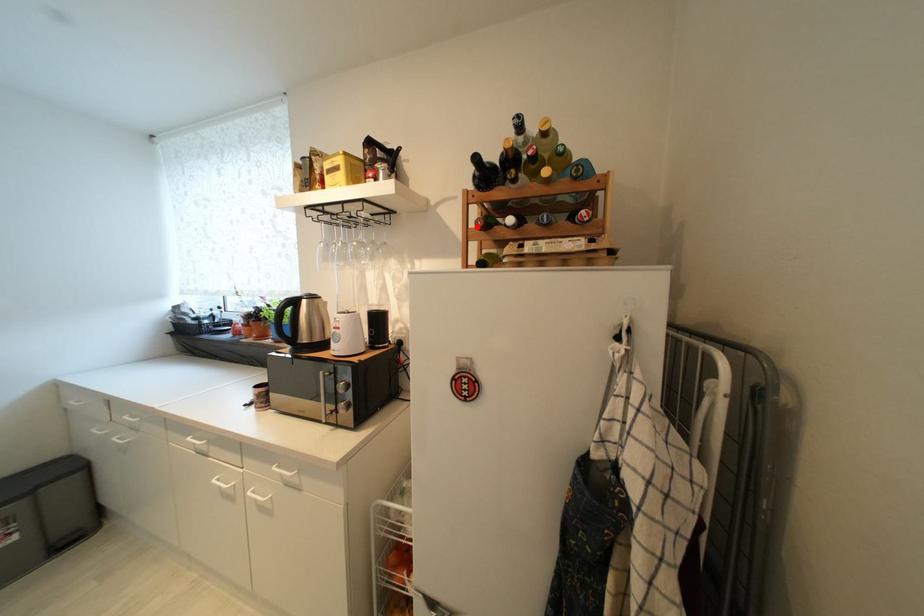
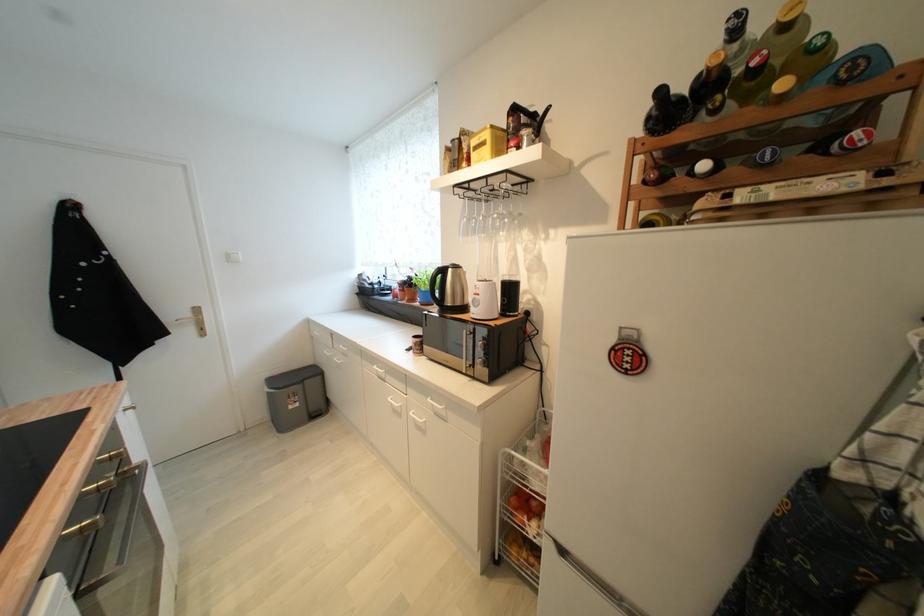
Question: I am providing you with two images of the same scene from different viewpoints. A red point is marked on the first image. At the location where the point appears in image 1, is it still visible in image 2?

Choices:
 (A) Yes
 (B) No

Answer: (A)